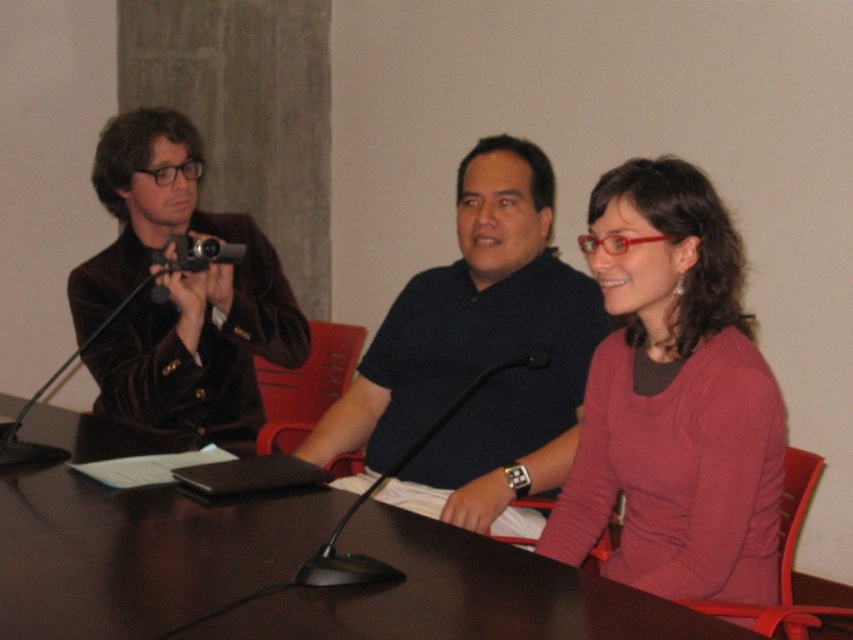
You are organizing a meeting and need to place a 10 cm tall document holder on the table. The document holder requires a space that is at least as tall as the black plastic camera at left. Can the dark wood table at center accommodate it?

The dark wood table at center is taller than the black plastic camera at left, so the document holder which is 10 cm tall can be accommodated since the table meets the height requirement.

You are a photographer trying to capture a photo of the pink sweater at center and the dark blue polo shirt at center. Which one is closer to the camera?

The pink sweater at center is positioned under the dark blue polo shirt at center, so the dark blue polo shirt at center is closer to the camera.

You are standing in front of the dark wood table at center and want to place a 1.2 meter long document on it. Can the document fit on the table?

The dark wood table at center and viewer are 1.04 meters apart. Since the document is 1.2 meters long, it cannot fit on the table as the table is shorter than the document.